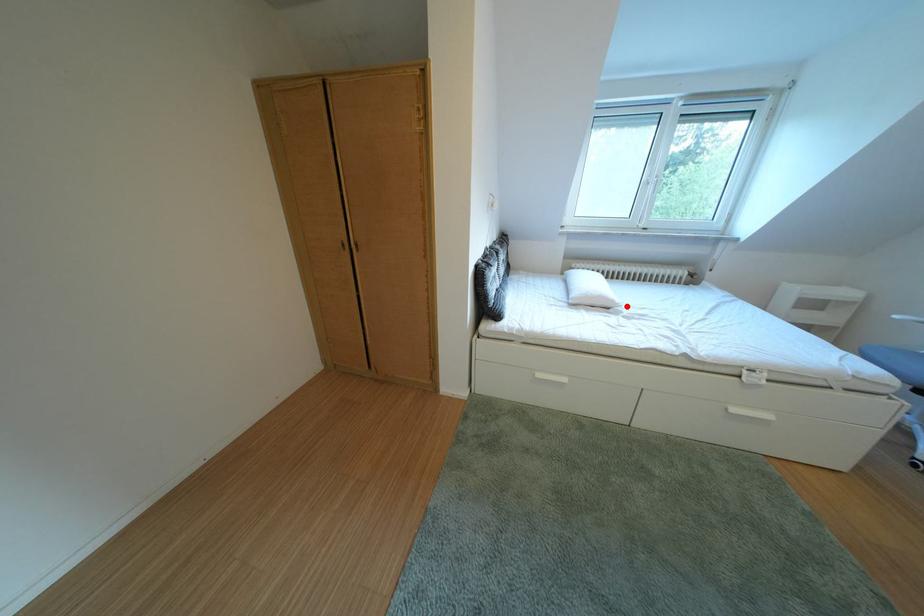
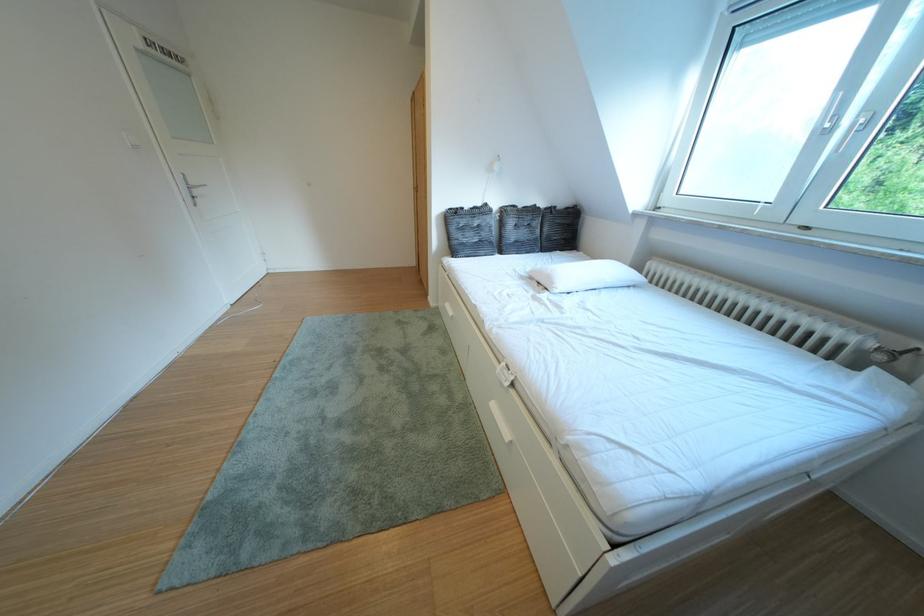
Where in the second image is the point corresponding to the highlighted location from the first image?

(565, 288)